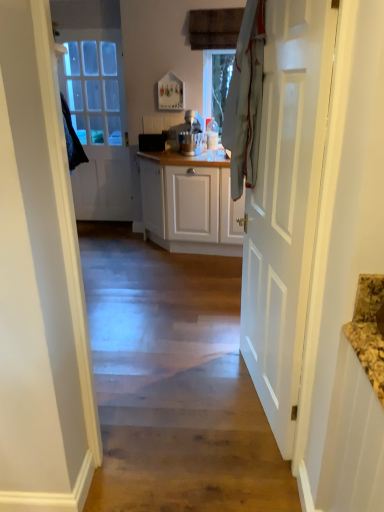
Question: Does wooden floor at center have a greater height compared to white glossy door at right, which is the 1th door in right-to-left order?

Choices:
 (A) no
 (B) yes

Answer: (A)

Question: Is wooden floor at center positioned in front of white glossy door at right, which appears as the 1th door when viewed from the front?

Choices:
 (A) yes
 (B) no

Answer: (B)

Question: From the image's perspective, is wooden floor at center under white glossy door at right, the 2th door in the back-to-front sequence?

Choices:
 (A) no
 (B) yes

Answer: (B)

Question: Is wooden floor at center positioned beyond the bounds of white glossy door at right, the 2th door in the back-to-front sequence?

Choices:
 (A) yes
 (B) no

Answer: (A)

Question: Is white glossy door at right, which is counted as the second door, starting from the left, surrounded by wooden floor at center?

Choices:
 (A) no
 (B) yes

Answer: (A)

Question: Is wooden floor at center bigger than white glossy door at right, which is the 1th door in right-to-left order?

Choices:
 (A) yes
 (B) no

Answer: (A)

Question: Considering the relative sizes of white glossy door at left, the first door positioned from the back, and wooden floor at center in the image provided, is white glossy door at left, the first door positioned from the back, smaller than wooden floor at center?

Choices:
 (A) no
 (B) yes

Answer: (B)

Question: Can you confirm if white glossy door at left, the 2th door from the right, is taller than wooden floor at center?

Choices:
 (A) no
 (B) yes

Answer: (B)

Question: Can you confirm if white glossy door at left, the first door positioned from the back, is shorter than wooden floor at center?

Choices:
 (A) no
 (B) yes

Answer: (A)

Question: Considering the relative sizes of white glossy door at left, which is the 2th door from front to back, and wooden floor at center in the image provided, is white glossy door at left, which is the 2th door from front to back, thinner than wooden floor at center?

Choices:
 (A) yes
 (B) no

Answer: (A)

Question: Is wooden floor at center at the back of white glossy door at left, which is the 2th door from front to back?

Choices:
 (A) no
 (B) yes

Answer: (A)

Question: Is white glossy door at left, which is the 2th door from front to back, with wooden floor at center?

Choices:
 (A) yes
 (B) no

Answer: (B)

Question: From the image's perspective, is white glossy door at right, which is counted as the second door, starting from the left, below white glossy door at left, the first door positioned from the back?

Choices:
 (A) no
 (B) yes

Answer: (B)